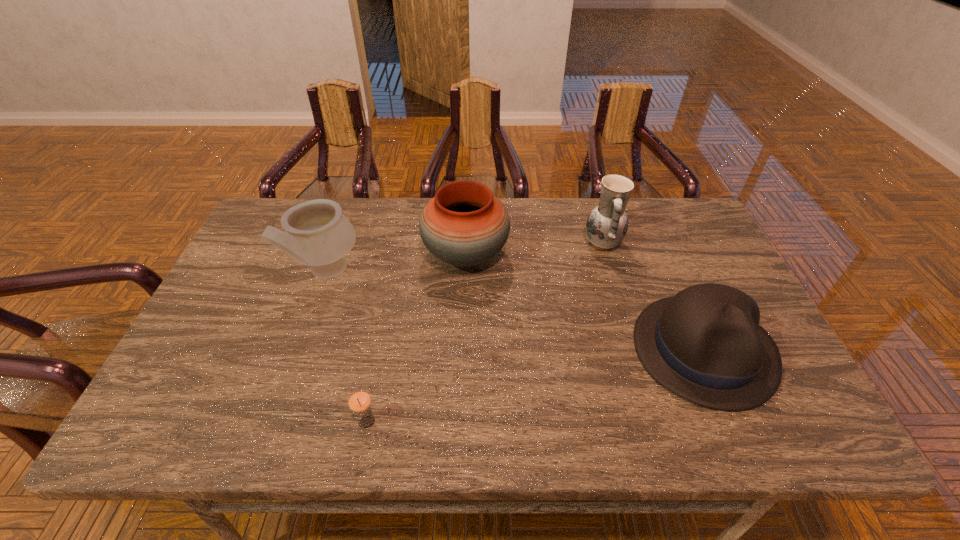
You are a GUI agent. You are given a task and a screenshot of the screen. Output one action in this format:
    pyautogui.click(x=<x>, y=<y>)
    Task: Click on the leftmost object
    The height and width of the screenshot is (540, 960).
    Given the screenshot: What is the action you would take?
    pyautogui.click(x=317, y=234)

At what (x,y) coordinates should I click in order to perform the action: click on the rightmost pottery. Please return your answer as a coordinate pair (x, y). Looking at the image, I should click on (607, 224).

At what (x,y) coordinates should I click in order to perform the action: click on the third object from left to right. Please return your answer as a coordinate pair (x, y). This screenshot has height=540, width=960. Looking at the image, I should click on (464, 225).

Where is `the fourth tallest object`? the fourth tallest object is located at coordinates (705, 344).

The height and width of the screenshot is (540, 960). I want to click on the second object from left to right, so click(x=359, y=401).

This screenshot has height=540, width=960. What are the coordinates of `straw` in the screenshot? It's located at [359, 401].

You are a GUI agent. You are given a task and a screenshot of the screen. Output one action in this format:
    pyautogui.click(x=<x>, y=<y>)
    Task: Click on the free region located on the left of the leftmost pottery
    
    Given the screenshot: What is the action you would take?
    pyautogui.click(x=269, y=271)

You are a GUI agent. You are given a task and a screenshot of the screen. Output one action in this format:
    pyautogui.click(x=<x>, y=<y>)
    Task: Click on the blank space located 0.090m on either side of the rightmost pottery
    This screenshot has width=960, height=540.
    Given the screenshot: What is the action you would take?
    pyautogui.click(x=554, y=244)

Find the location of a particular element. free space located 0.070m on either side of the rightmost pottery is located at coordinates (560, 244).

The height and width of the screenshot is (540, 960). I want to click on free space located on either side of the rightmost pottery, so click(x=489, y=244).